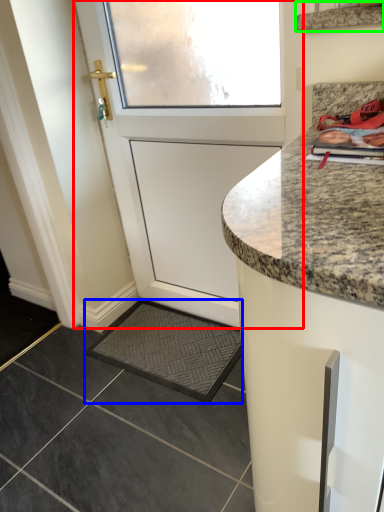
Question: Estimate the real-world distances between objects in this image. Which object is closer to door (highlighted by a red box), slate (highlighted by a blue box) or shelf (highlighted by a green box)?

Choices:
 (A) slate
 (B) shelf

Answer: (A)